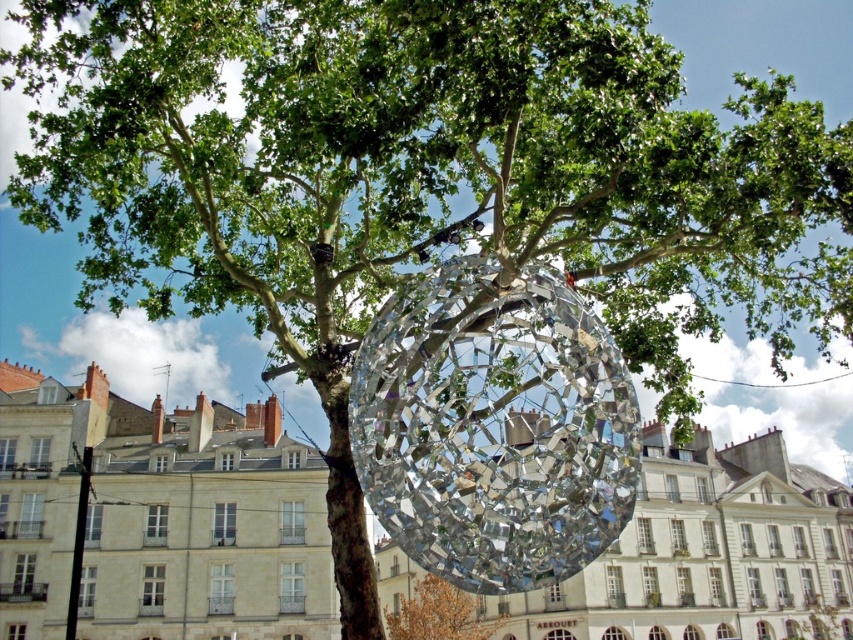
Between point (668, 516) and point (573, 444), which one is positioned in front?

Point (573, 444) is more forward.

Is clear glass sphere at center below shiny metallic disco ball at center?

Correct, clear glass sphere at center is located below shiny metallic disco ball at center.

The width and height of the screenshot is (853, 640). I want to click on clear glass sphere at center, so click(x=160, y=516).

The height and width of the screenshot is (640, 853). What do you see at coordinates (494, 428) in the screenshot? I see `shiny metallic disco ball at center` at bounding box center [494, 428].

Can you confirm if shiny metallic disco ball at center is taller than shiny metallic sphere at center?

Correct, shiny metallic disco ball at center is much taller as shiny metallic sphere at center.

What do you see at coordinates (494, 428) in the screenshot?
I see `shiny metallic disco ball at center` at bounding box center [494, 428].

Where is `shiny metallic disco ball at center`? This screenshot has height=640, width=853. shiny metallic disco ball at center is located at coordinates (494, 428).

Who is more forward, (738, 616) or (453, 592)?

Point (453, 592) is in front.

Who is lower down, clear glass sphere at center or shiny metallic sphere at center?

shiny metallic sphere at center is lower down.

The height and width of the screenshot is (640, 853). In order to click on clear glass sphere at center in this screenshot , I will do `click(160, 516)`.

The image size is (853, 640). I want to click on clear glass sphere at center, so click(x=160, y=516).